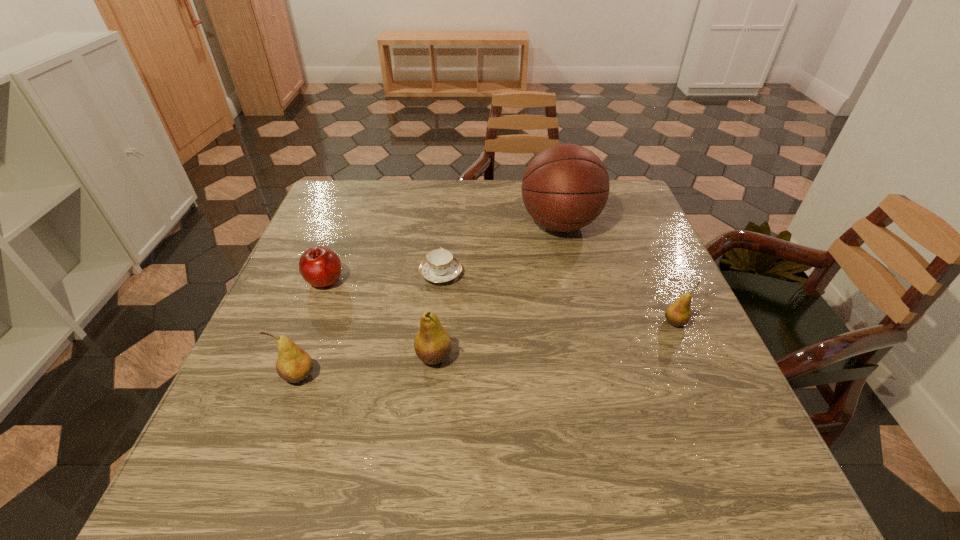
In order to click on apple located at the left edge in this screenshot , I will do `click(321, 267)`.

Locate an element on the screen. The height and width of the screenshot is (540, 960). pear at the right edge is located at coordinates (678, 313).

The image size is (960, 540). I want to click on basketball at the right edge, so click(565, 187).

The width and height of the screenshot is (960, 540). I want to click on object present at the far right corner, so click(x=565, y=187).

The width and height of the screenshot is (960, 540). I want to click on free space at the far edge of the desktop, so click(419, 192).

In the image, there is a desktop. Where is `vacant space at the near edge`? vacant space at the near edge is located at coordinates (558, 423).

Identify the location of free space at the left edge of the desktop. This screenshot has height=540, width=960. (297, 332).

Find the location of a particular element. This screenshot has height=540, width=960. free space at the right edge of the desktop is located at coordinates (612, 251).

I want to click on blank area at the near left corner, so click(261, 403).

The image size is (960, 540). In order to click on free space at the far right corner of the desktop in this screenshot , I will do `click(636, 209)`.